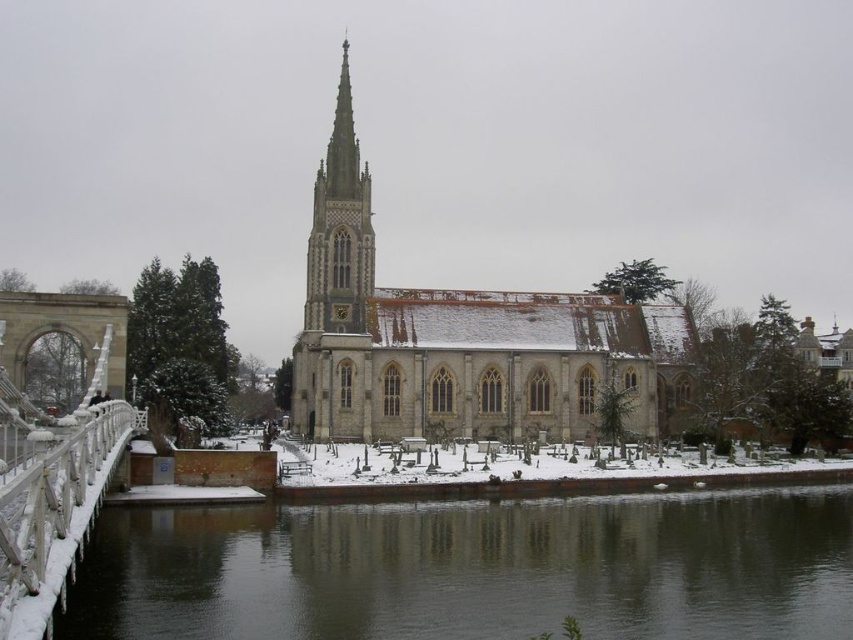
You are a delivery person trying to park your vehicle near the church. You see the black ice at lower left and the white stone spire at center. Which object should you avoid parking near to prevent slipping?

You should avoid parking near the black ice at lower left because it is located below the white stone spire at center and poses a slipping hazard.

You are standing at the entrance of the church and want to cross to the other side of the river. The white frosted bridge at left and the white stone spire at center are visible. Which object is closer to the ground level?

The white frosted bridge at left is closer to the ground level because it is below the white stone spire at center.

You are standing at the entrance of the church and looking towards the cemetery. There are two points marked in the scene. The first point is at coordinate point(299, 577) and the second is at point(79, 483). Which point is closer to you?

Point(79, 483) is closer to you because it is in front of point(299, 577).